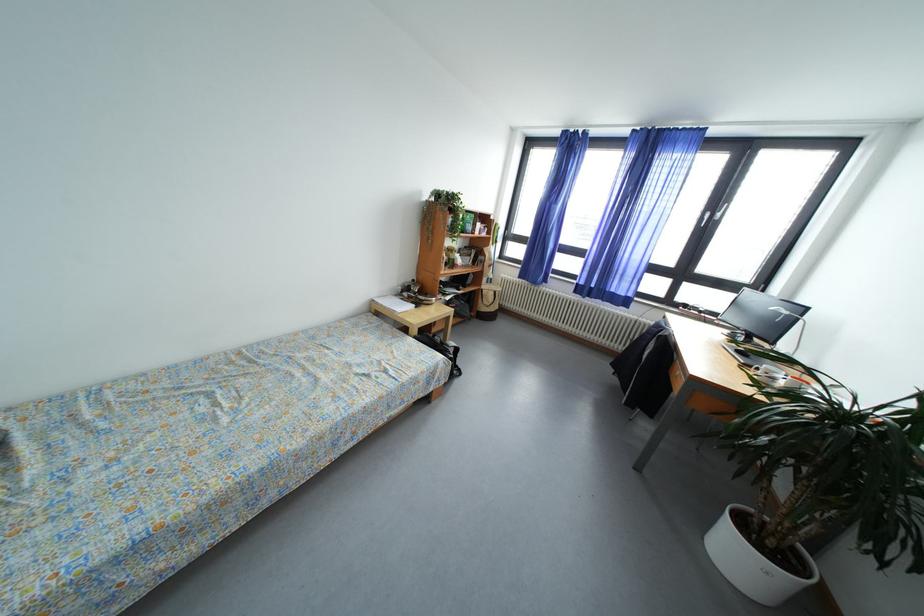
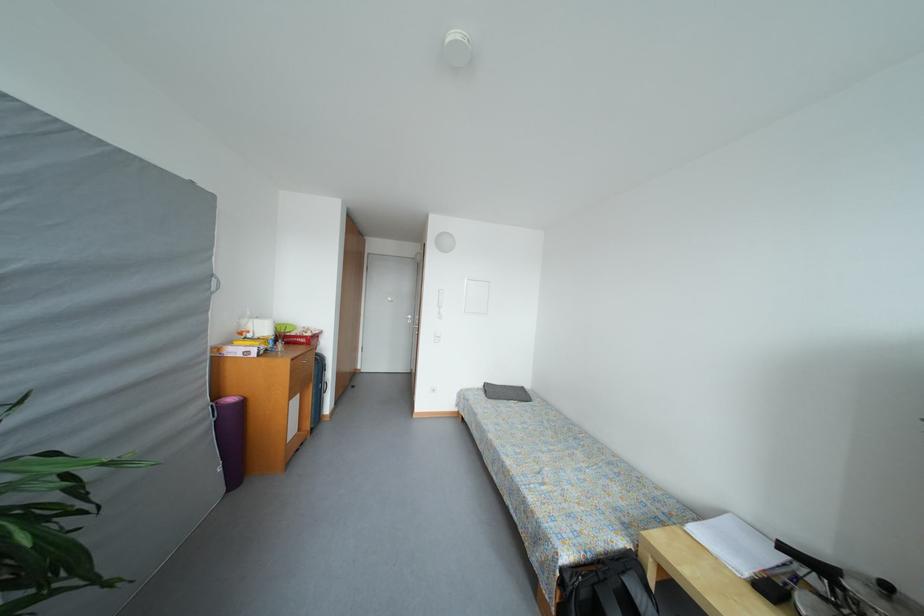
The point at (302, 448) is marked in the first image. Where is the corresponding point in the second image?

(496, 440)